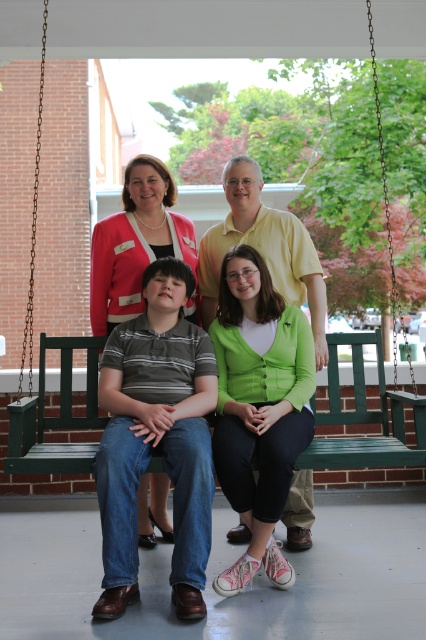
Consider the image. Is matte striped shirt at center positioned at the back of yellow matte shirt at upper center?

That is False.

Can you confirm if matte striped shirt at center is bigger than yellow matte shirt at upper center?

Yes, matte striped shirt at center is bigger than yellow matte shirt at upper center.

Locate an element on the screen. Image resolution: width=426 pixels, height=640 pixels. matte striped shirt at center is located at coordinates (157, 438).

Locate an element on the screen. The height and width of the screenshot is (640, 426). matte striped shirt at center is located at coordinates (157, 438).

From the picture: Is matte green cardigan at center to the right of yellow matte shirt at upper center from the viewer's perspective?

Indeed, matte green cardigan at center is positioned on the right side of yellow matte shirt at upper center.

Is the position of matte green cardigan at center more distant than that of yellow matte shirt at upper center?

Yes.

Is point (146, 480) farther from camera compared to point (321, 301)?

Yes, it is.

You are a GUI agent. You are given a task and a screenshot of the screen. Output one action in this format:
    pyautogui.click(x=<x>, y=<y>)
    Task: Click on the matte green cardigan at center
    The width and height of the screenshot is (426, 640).
    Given the screenshot: What is the action you would take?
    tap(135, 241)

Which is more to the right, green wooden bench at center or matte green cardigan at center?

Positioned to the right is matte green cardigan at center.

Is green wooden bench at center further to camera compared to matte green cardigan at center?

Yes.

Find the location of `green wooden bench at center`. green wooden bench at center is located at coordinates 206,28.